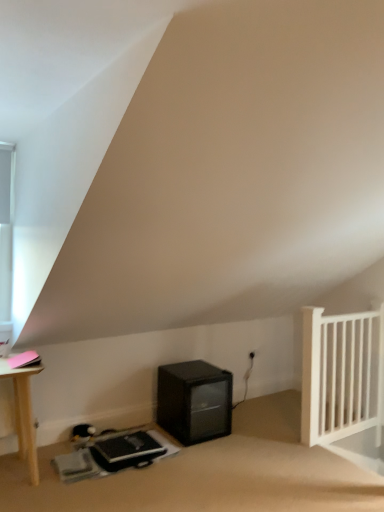
Question: Choose the correct answer: Is black matte mini-fridge at lower center inside white wooden radiator at right or outside it?

Choices:
 (A) inside
 (B) outside

Answer: (B)

Question: Is black matte mini-fridge at lower center to the left or to the right of white wooden radiator at right in the image?

Choices:
 (A) right
 (B) left

Answer: (B)

Question: Which is nearer to the white glass window at upper left?

Choices:
 (A) black matte mini-fridge at lower center
 (B) white wooden radiator at right

Answer: (A)

Question: Which of these objects is positioned closest to the white glass window at upper left?

Choices:
 (A) white wooden radiator at right
 (B) black matte mini-fridge at lower center

Answer: (B)